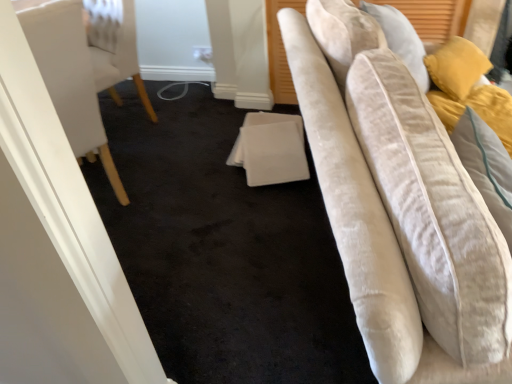
Question: Based on their positions, is white fabric at center located to the left or right of velvet beige chair at left?

Choices:
 (A) right
 (B) left

Answer: (A)

Question: Is white fabric at center spatially inside velvet beige chair at left, or outside of it?

Choices:
 (A) outside
 (B) inside

Answer: (A)

Question: From the image's perspective, is white fabric at center above or below velvet beige chair at left?

Choices:
 (A) below
 (B) above

Answer: (A)

Question: Is point (77, 8) closer or farther from the camera than point (279, 152)?

Choices:
 (A) closer
 (B) farther

Answer: (A)

Question: Considering the positions of velvet beige chair at left and white fabric at center in the image, is velvet beige chair at left wider or thinner than white fabric at center?

Choices:
 (A) wide
 (B) thin

Answer: (A)

Question: From the image's perspective, is velvet beige chair at left located above or below white fabric at center?

Choices:
 (A) above
 (B) below

Answer: (A)

Question: From a real-world perspective, is velvet beige chair at left physically located above or below white fabric at center?

Choices:
 (A) below
 (B) above

Answer: (B)